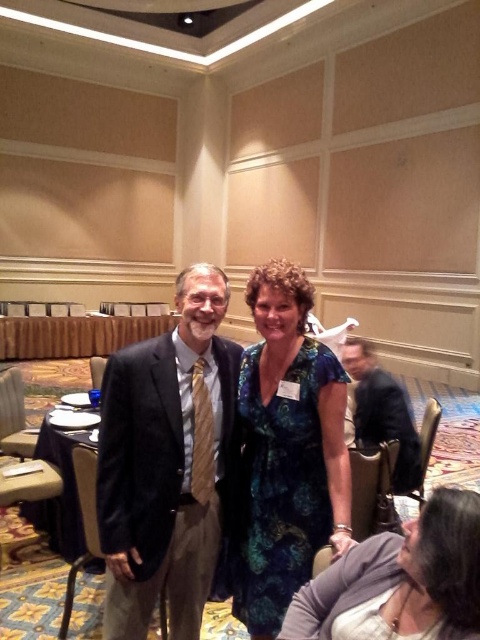
Can you confirm if blue floral dress at center is shorter than dark suit at right?

In fact, blue floral dress at center may be taller than dark suit at right.

The image size is (480, 640). Find the location of `blue floral dress at center`. blue floral dress at center is located at coordinates (288, 449).

Which is behind, point (144, 550) or point (324, 394)?

Positioned behind is point (324, 394).

The width and height of the screenshot is (480, 640). Find the location of `velvet black suit at center`. velvet black suit at center is located at coordinates (168, 461).

Between blue floral dress at center and floral dress at center, which one appears on the right side from the viewer's perspective?

From the viewer's perspective, floral dress at center appears more on the right side.

Image resolution: width=480 pixels, height=640 pixels. What do you see at coordinates (288, 449) in the screenshot? I see `blue floral dress at center` at bounding box center [288, 449].

Between point (262, 346) and point (421, 528), which one is positioned behind?

Positioned behind is point (262, 346).

What are the coordinates of `blue floral dress at center` in the screenshot? It's located at (288, 449).